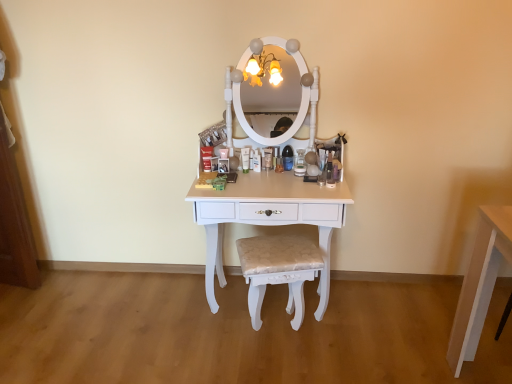
This screenshot has height=384, width=512. In order to click on blank space above beige fabric cushioned stool at center (from a real-world perspective) in this screenshot , I will do `click(279, 251)`.